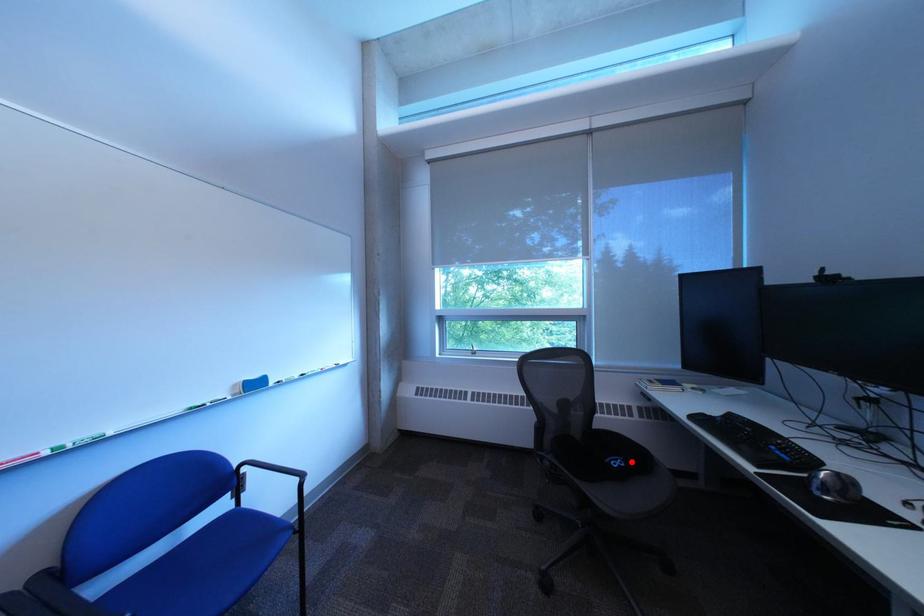
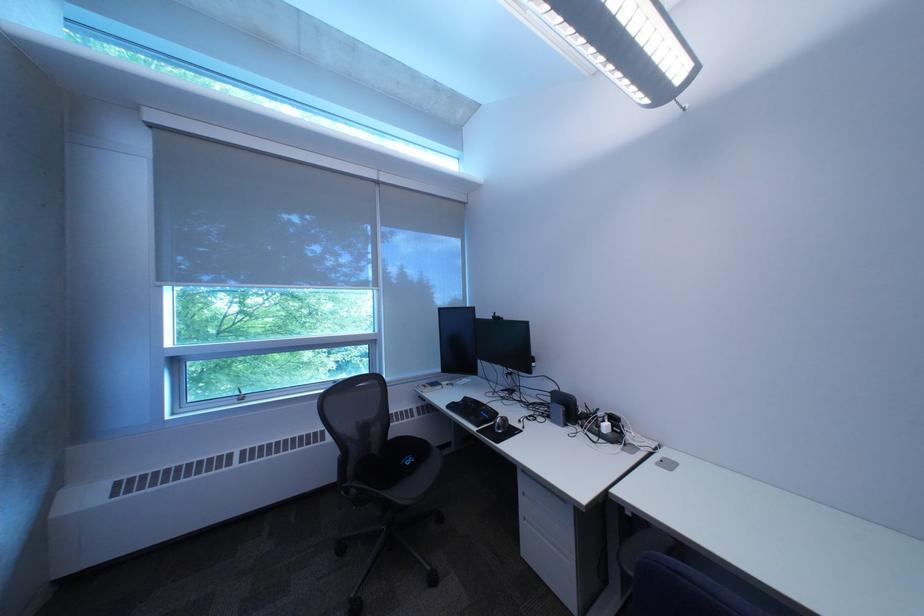
Where in the second image is the point corresponding to the highlighted location from the first image?

(423, 461)